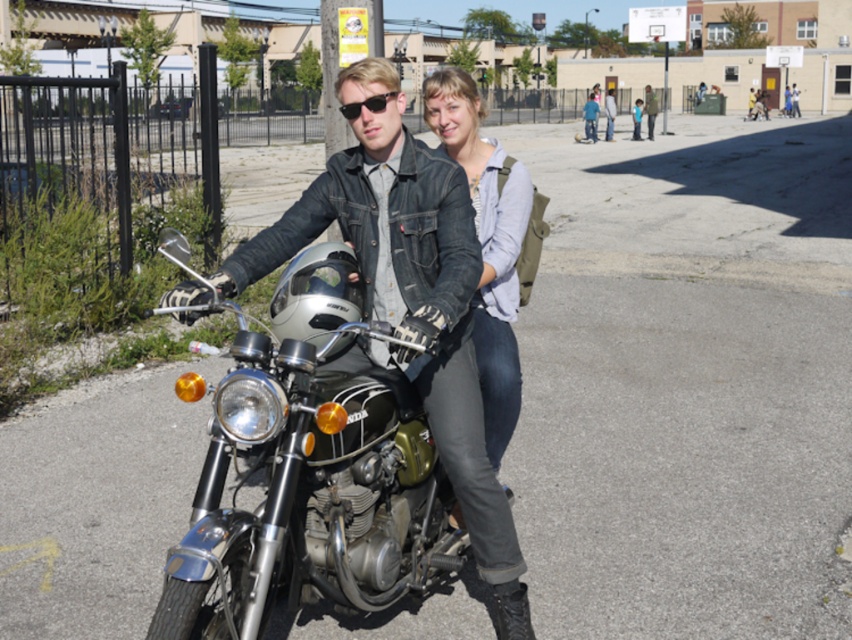
Question: Which of the following is the farthest from the observer?

Choices:
 (A) (453, 145)
 (B) (383, 525)
 (C) (371, 108)

Answer: (A)

Question: Which of the following is the farthest from the observer?

Choices:
 (A) (352, 444)
 (B) (525, 232)
 (C) (378, 99)

Answer: (B)

Question: Considering the relative positions of shiny chrome motorcycle at center and black matte sunglasses at center in the image provided, where is shiny chrome motorcycle at center located with respect to black matte sunglasses at center?

Choices:
 (A) left
 (B) right

Answer: (B)

Question: Does shiny chrome motorcycle at center have a smaller size compared to denim jacket at center?

Choices:
 (A) no
 (B) yes

Answer: (A)

Question: Does denim jacket at center come behind black matte sunglasses at center?

Choices:
 (A) no
 (B) yes

Answer: (B)

Question: Which is nearer to the black matte sunglasses at center?

Choices:
 (A) denim jacket at center
 (B) shiny chrome motorcycle at center

Answer: (A)